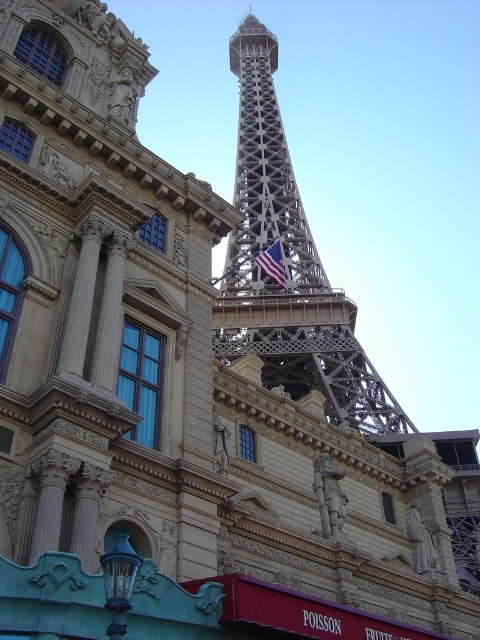
Question: Where is metallic structure at center located in relation to american flag at center in the image?

Choices:
 (A) below
 (B) above

Answer: (B)

Question: Which point is farther to the camera?

Choices:
 (A) american flag at center
 (B) metallic structure at center

Answer: (A)

Question: Observing the image, what is the correct spatial positioning of metallic structure at center in reference to american flag at center?

Choices:
 (A) left
 (B) right

Answer: (A)

Question: Where is metallic structure at center located in relation to american flag at center in the image?

Choices:
 (A) right
 (B) left

Answer: (B)